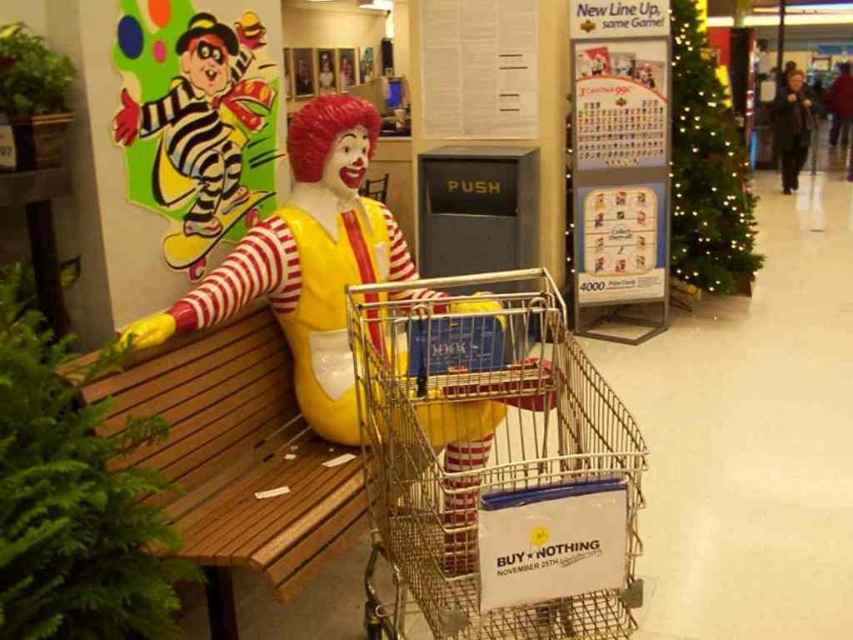
Can you confirm if wooden bench at left is wider than colorful paper clown at upper left?

Indeed, wooden bench at left has a greater width compared to colorful paper clown at upper left.

Between wooden bench at left and colorful paper clown at upper left, which one is positioned higher?

colorful paper clown at upper left

Which is behind, point (155, 412) or point (202, 106)?

Point (202, 106)

Identify the location of wooden bench at left. The image size is (853, 640). (236, 458).

Between metallic silver shopping cart at center and wooden bench at left, which one is positioned lower?

metallic silver shopping cart at center is below.

Based on the photo, does metallic silver shopping cart at center have a smaller size compared to wooden bench at left?

No, metallic silver shopping cart at center is not smaller than wooden bench at left.

You are a GUI agent. You are given a task and a screenshot of the screen. Output one action in this format:
    pyautogui.click(x=<x>, y=<y>)
    Task: Click on the metallic silver shopping cart at center
    Image resolution: width=853 pixels, height=640 pixels.
    Given the screenshot: What is the action you would take?
    pyautogui.click(x=492, y=461)

Who is positioned more to the left, metallic silver shopping cart at center or dark gray sweater at right?

metallic silver shopping cart at center

Where is `metallic silver shopping cart at center`? metallic silver shopping cart at center is located at coordinates (492, 461).